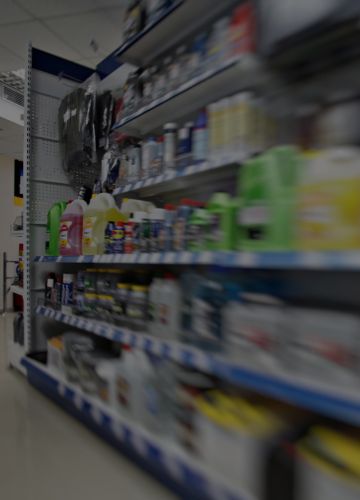
Identify the location of white drop ceiling. (73, 25).